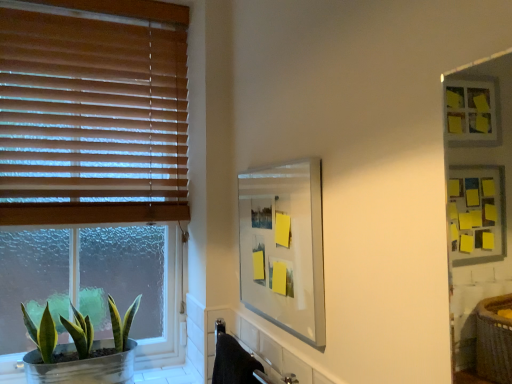
Find the location of a particular element. green matte plant at lower left is located at coordinates (81, 349).

The height and width of the screenshot is (384, 512). Find the location of `wooden blinds at left`. wooden blinds at left is located at coordinates (93, 111).

Where is `green matte plant at lower left`? green matte plant at lower left is located at coordinates (81, 349).

From the image's perspective, between clear glass mirror at center and wooden blinds at left, who is located below?

clear glass mirror at center appears lower in the image.

Does clear glass mirror at center have a lesser height compared to wooden blinds at left?

Indeed, clear glass mirror at center has a lesser height compared to wooden blinds at left.

Does clear glass mirror at center have a larger size compared to wooden blinds at left?

Incorrect, clear glass mirror at center is not larger than wooden blinds at left.

The height and width of the screenshot is (384, 512). I want to click on mirror below the wooden blinds at left (from the image's perspective), so click(x=284, y=247).

From the image's perspective, is green matte plant at lower left beneath clear glass mirror at center?

Indeed, from the image's perspective, green matte plant at lower left is shown beneath clear glass mirror at center.

Considering the positions of objects green matte plant at lower left and clear glass mirror at center in the image provided, who is in front, green matte plant at lower left or clear glass mirror at center?

Positioned in front is clear glass mirror at center.

Between green matte plant at lower left and clear glass mirror at center, which one has larger size?

Bigger between the two is green matte plant at lower left.

Measure the distance from green matte plant at lower left to clear glass mirror at center.

green matte plant at lower left is 69.04 centimeters from clear glass mirror at center.

In the scene shown: From a real-world perspective, is clear glass mirror at center on top of green matte plant at lower left?

Correct, in the physical world, clear glass mirror at center is higher than green matte plant at lower left.

Is clear glass mirror at center spatially inside green matte plant at lower left, or outside of it?

clear glass mirror at center is located beyond the bounds of green matte plant at lower left.

Which object is thinner, clear glass mirror at center or green matte plant at lower left?

clear glass mirror at center.

Is wooden blinds at left looking in the opposite direction of green matte plant at lower left?

That's not correct — wooden blinds at left is not looking away from green matte plant at lower left.

Does wooden blinds at left have a smaller size compared to green matte plant at lower left?

Incorrect, wooden blinds at left is not smaller in size than green matte plant at lower left.

Is wooden blinds at left far from green matte plant at lower left?

No, wooden blinds at left is not far away from green matte plant at lower left.

From a real-world perspective, is wooden blinds at left on top of clear glass mirror at center?

Yes.

Considering the positions of objects wooden blinds at left and clear glass mirror at center in the image provided, who is more to the right, wooden blinds at left or clear glass mirror at center?

clear glass mirror at center.

From the image's perspective, is wooden blinds at left located beneath clear glass mirror at center?

No.

Based on the photo, could you tell me if wooden blinds at left is facing clear glass mirror at center?

Yes, wooden blinds at left is facing clear glass mirror at center.

Considering the sizes of objects green matte plant at lower left and wooden blinds at left in the image provided, who is wider, green matte plant at lower left or wooden blinds at left?

Wider between the two is green matte plant at lower left.

Are green matte plant at lower left and wooden blinds at left located far from each other?

No, green matte plant at lower left is not far from wooden blinds at left.

Is green matte plant at lower left turned away from wooden blinds at left?

green matte plant at lower left does not have its back to wooden blinds at left.

How many degrees apart are the facing directions of green matte plant at lower left and wooden blinds at left?

green matte plant at lower left and wooden blinds at left are facing 0.595 degrees away from each other.

Where is `mirror on the right of wooden blinds at left`? mirror on the right of wooden blinds at left is located at coordinates (284, 247).

Find the location of a particular element. houseplant behind the clear glass mirror at center is located at coordinates (81, 349).

Which object lies nearer to the anchor point green matte plant at lower left, wooden blinds at left or clear glass mirror at center?

Based on the image, wooden blinds at left appears to be nearer to green matte plant at lower left.

When comparing their distances from clear glass mirror at center, does green matte plant at lower left or wooden blinds at left seem closer?

wooden blinds at left is closer to clear glass mirror at center.

Based on their spatial positions, is green matte plant at lower left or clear glass mirror at center further from wooden blinds at left?

clear glass mirror at center is positioned further to the anchor wooden blinds at left.

Considering their positions, is wooden blinds at left positioned further to clear glass mirror at center than green matte plant at lower left?

green matte plant at lower left is positioned further to the anchor clear glass mirror at center.

Estimate the real-world distances between objects in this image. Which object is closer to green matte plant at lower left, clear glass mirror at center or wooden blinds at left?

wooden blinds at left lies closer to green matte plant at lower left than the other object.

When comparing their distances from wooden blinds at left, does clear glass mirror at center or green matte plant at lower left seem further?

clear glass mirror at center.

Locate an element on the screen. Image resolution: width=512 pixels, height=384 pixels. mirror that lies between wooden blinds at left and green matte plant at lower left from top to bottom is located at coordinates (284, 247).